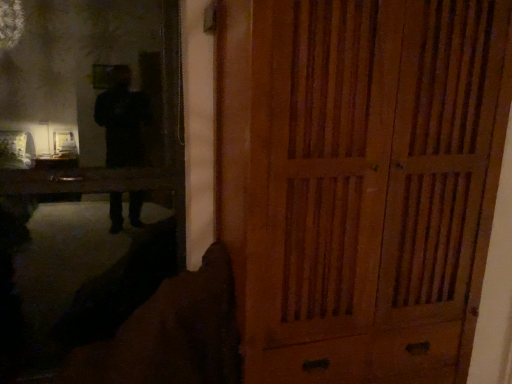
Identify the location of wooden cabinet at right. (360, 181).

In order to face wooden cabinet at right, should I rotate leftwards or rightwards?

A 11.424 degree turn to the right will do.

Describe the element at coordinates (360, 181) in the screenshot. I see `wooden cabinet at right` at that location.

This screenshot has height=384, width=512. Describe the element at coordinates (84, 171) in the screenshot. I see `matte black mirror at upper left` at that location.

What is the approximate height of matte black mirror at upper left?

It is 1.88 meters.

Locate an element on the screen. The width and height of the screenshot is (512, 384). matte black mirror at upper left is located at coordinates (84, 171).

I want to click on wooden cabinet at right, so click(360, 181).

Is matte black mirror at upper left to the left of wooden cabinet at right from the viewer's perspective?

Indeed, matte black mirror at upper left is positioned on the left side of wooden cabinet at right.

In the image, is matte black mirror at upper left positioned in front of or behind wooden cabinet at right?

Clearly, matte black mirror at upper left is behind wooden cabinet at right.

Which is in front, point (104, 43) or point (267, 42)?

The point (267, 42) is more forward.

From the image's perspective, is matte black mirror at upper left below wooden cabinet at right?

No.

From a real-world perspective, is matte black mirror at upper left over wooden cabinet at right?

Actually, matte black mirror at upper left is physically below wooden cabinet at right in the real world.

In terms of width, does matte black mirror at upper left look wider or thinner when compared to wooden cabinet at right?

Considering their sizes, matte black mirror at upper left looks slimmer than wooden cabinet at right.

Who is taller, matte black mirror at upper left or wooden cabinet at right?

Standing taller between the two is wooden cabinet at right.

Considering the relative sizes of matte black mirror at upper left and wooden cabinet at right in the image provided, is matte black mirror at upper left bigger than wooden cabinet at right?

No, matte black mirror at upper left is not bigger than wooden cabinet at right.

Is wooden cabinet at right located within matte black mirror at upper left?

Definitely not — wooden cabinet at right is not inside matte black mirror at upper left.

Is matte black mirror at upper left not close to wooden cabinet at right?

Yes, matte black mirror at upper left and wooden cabinet at right are located far from each other.

Is wooden cabinet at right at the back of matte black mirror at upper left?

No.

What's the angular difference between matte black mirror at upper left and wooden cabinet at right's facing directions?

The facing directions of matte black mirror at upper left and wooden cabinet at right are 0.565 degrees apart.

Locate an element on the screen. The height and width of the screenshot is (384, 512). mirror on the left of wooden cabinet at right is located at coordinates (84, 171).

Is wooden cabinet at right to the left or to the right of matte black mirror at upper left in the image?

wooden cabinet at right is positioned on matte black mirror at upper left's right side.

Is wooden cabinet at right in front of or behind matte black mirror at upper left in the image?

wooden cabinet at right is in front of matte black mirror at upper left.

Which is behind, point (399, 78) or point (109, 59)?

The point (109, 59) is farther from the camera.

Consider the image. From the image's perspective, is wooden cabinet at right located above or below matte black mirror at upper left?

From the image's perspective, wooden cabinet at right appears below matte black mirror at upper left.

From a real-world perspective, who is located higher, wooden cabinet at right or matte black mirror at upper left?

In real-world perspective, wooden cabinet at right is above.

Considering the relative sizes of wooden cabinet at right and matte black mirror at upper left in the image provided, is wooden cabinet at right wider than matte black mirror at upper left?

Indeed, wooden cabinet at right has a greater width compared to matte black mirror at upper left.

Does wooden cabinet at right have a greater height compared to matte black mirror at upper left?

Correct, wooden cabinet at right is much taller as matte black mirror at upper left.

Can you confirm if wooden cabinet at right is smaller than matte black mirror at upper left?

Actually, wooden cabinet at right might be larger than matte black mirror at upper left.

Is matte black mirror at upper left completely or partially inside wooden cabinet at right?

No, matte black mirror at upper left is located outside of wooden cabinet at right.

Are wooden cabinet at right and matte black mirror at upper left far apart?

Yes.

Is wooden cabinet at right aimed at matte black mirror at upper left?

No, wooden cabinet at right is not aimed at matte black mirror at upper left.

How different are the orientations of wooden cabinet at right and matte black mirror at upper left in degrees?

wooden cabinet at right and matte black mirror at upper left are facing 0.565 degrees away from each other.

How much distance is there between wooden cabinet at right and matte black mirror at upper left?

The distance of wooden cabinet at right from matte black mirror at upper left is 1.45 meters.

Where is `door below the matte black mirror at upper left (from the image's perspective)`? door below the matte black mirror at upper left (from the image's perspective) is located at coordinates (360, 181).

You are a GUI agent. You are given a task and a screenshot of the screen. Output one action in this format:
    pyautogui.click(x=<x>, y=<y>)
    Task: Click on the door above the matte black mirror at upper left (from a real-world perspective)
    The width and height of the screenshot is (512, 384).
    Given the screenshot: What is the action you would take?
    pyautogui.click(x=360, y=181)

Where is `mirror above the wooden cabinet at right (from the image's perspective)`? This screenshot has height=384, width=512. mirror above the wooden cabinet at right (from the image's perspective) is located at coordinates (84, 171).